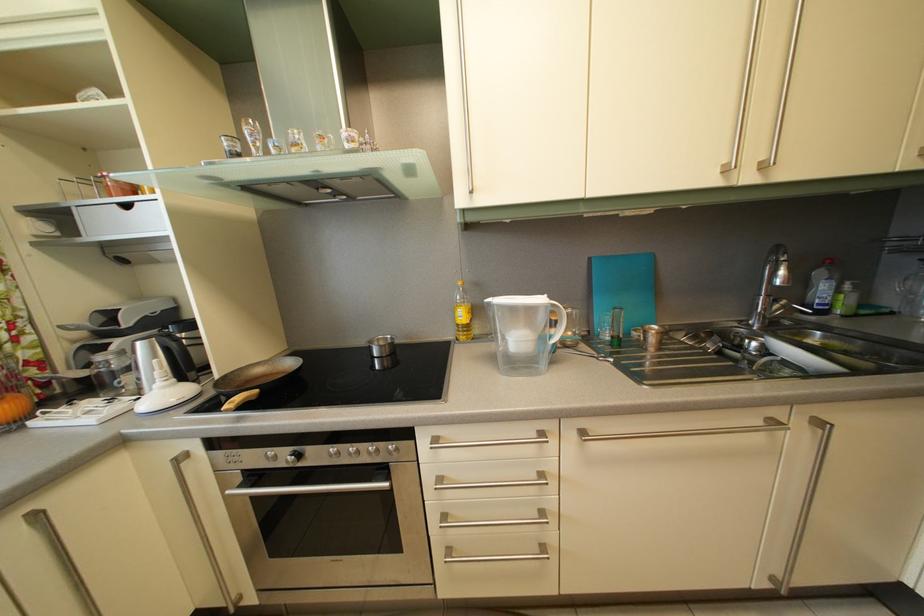
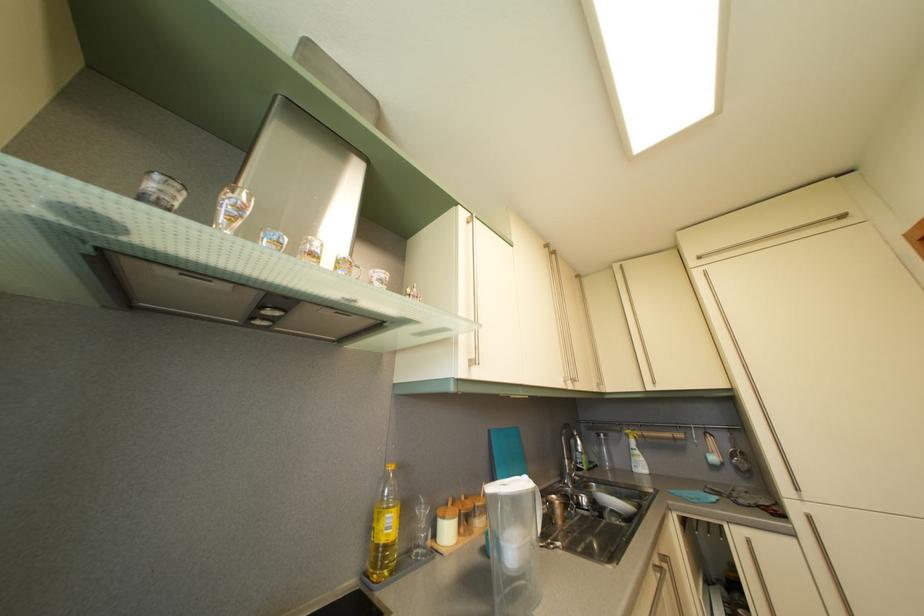
Where in the second image is the point corresponding to pixel 598 267 from the first image?

(497, 439)